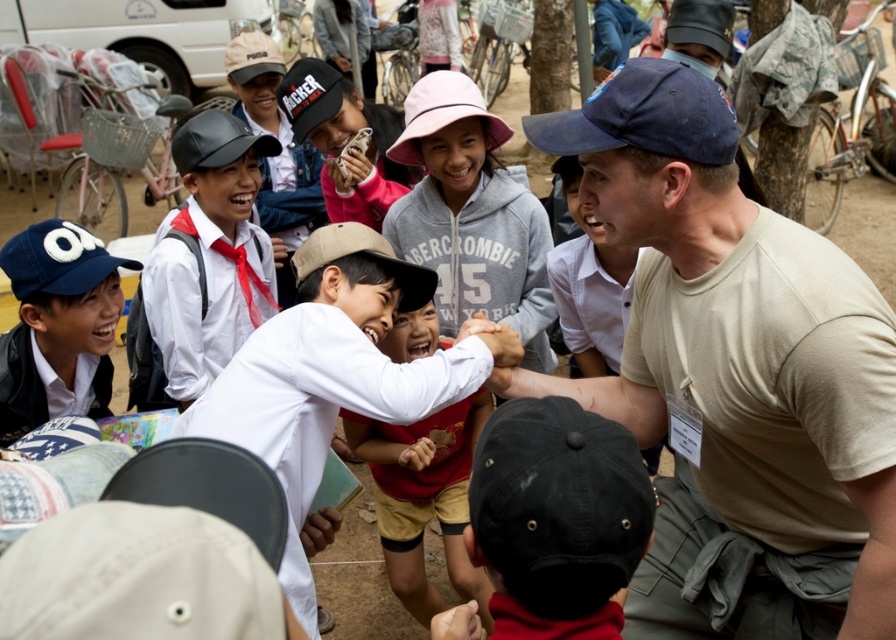
You are standing at the position of the adult male in the scene. There is a white matte shirt at center and a black cap with Rockstar written on it. Which object is closer to you?

The white matte shirt at center is closer to you because they are 3.85 meters apart.

You are standing at the origin point of the scene. There are two points marked in the image. The first point is at coordinates point (725, 198) and the second point is at point (636, 116). Which point is farther away from you?

Point (725, 198) is farther away from you because it is behind point (636, 116).